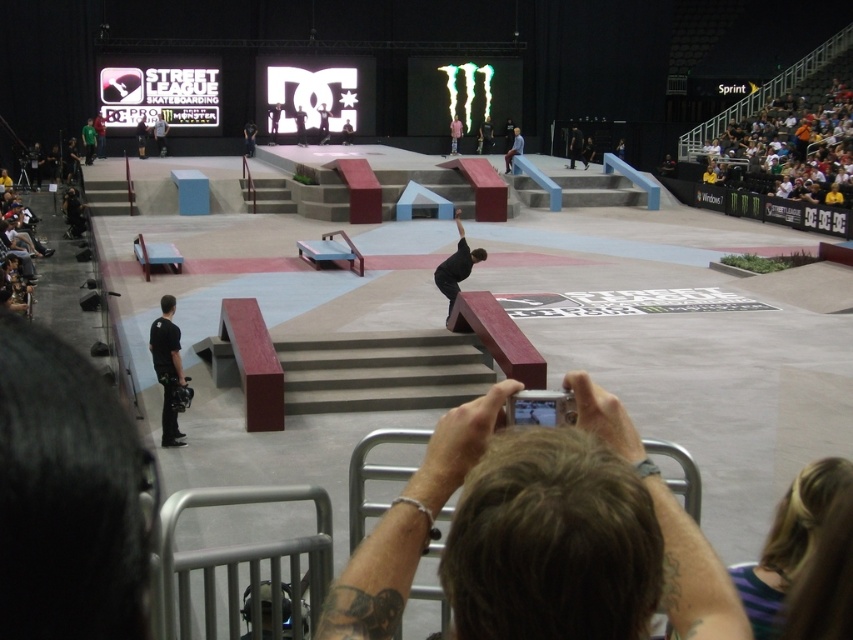
You are a photographer at the Street League Skateboarding competition. You notice the dark brown hair at lower center and the black matte camera at center. Which object is smaller in size?

The dark brown hair at lower center is smaller in size compared to the black matte camera at center.

You are a photographer at the skateboarding event. You need to capture a clear photo of the skateboarder performing a trick on the red rail. You have a black matte camera at center and a light blue shirt at upper right in your viewfinder. Which object should you adjust your focus to prioritize for the best shot?

The black matte camera at center has a larger size compared to the light blue shirt at upper right, so you should prioritize focusing on the black matte camera at center to ensure it is in clear focus for the best shot.